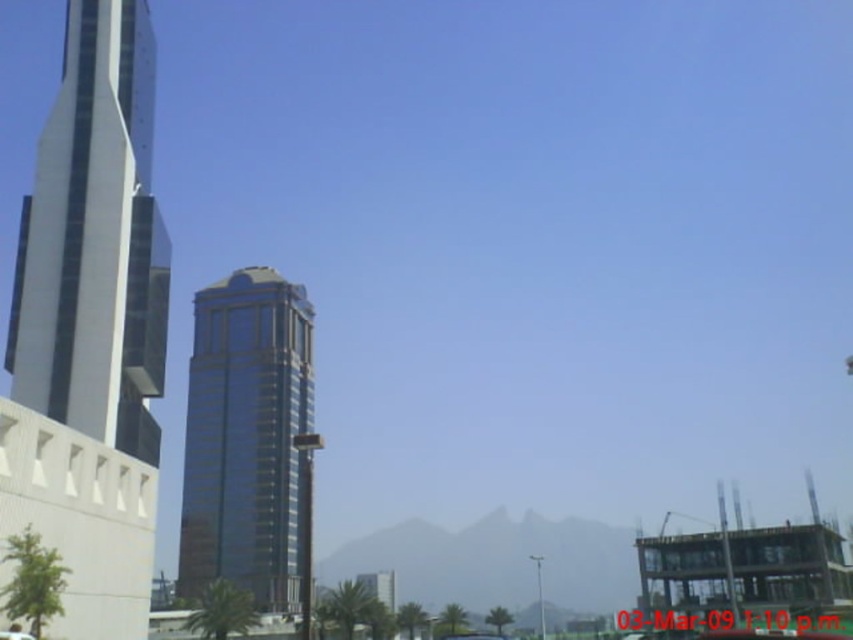
You are an architect evaluating the urban layout. Given the glassy metallic skyscraper at left and the glossy glass tower at center, which one has a narrower structure?

The glassy metallic skyscraper at left has a lesser width compared to the glossy glass tower at center, so it is narrower.

You are a photographer planning to capture the glassy metallic skyscraper at left and the metallic silver car at lower left in a single shot. Given that the skyscraper is much larger than the car, how might you position your camera to ensure both are visible in the frame?

To capture both the glassy metallic skyscraper at left and the metallic silver car at lower left in one shot, position the camera closer to the metallic silver car at lower left. This will make the car appear larger in the frame, balancing its size with the distant, larger skyscraper. Alternatively, use a wide angle lens to include both the foreground car and the background skyscraper.

You are standing in the urban landscape and want to take a photo of the glossy glass tower at center and the metallic silver car at lower left. If you want the car to appear to the right of the tower in your photo, should you position yourself to the left or right of the car?

You should position yourself to the right of the metallic silver car at lower left. Since the glossy glass tower at center is positioned on the left side of the metallic silver car at lower left, moving to the right of the car will place the tower to the left of the car in the photo.